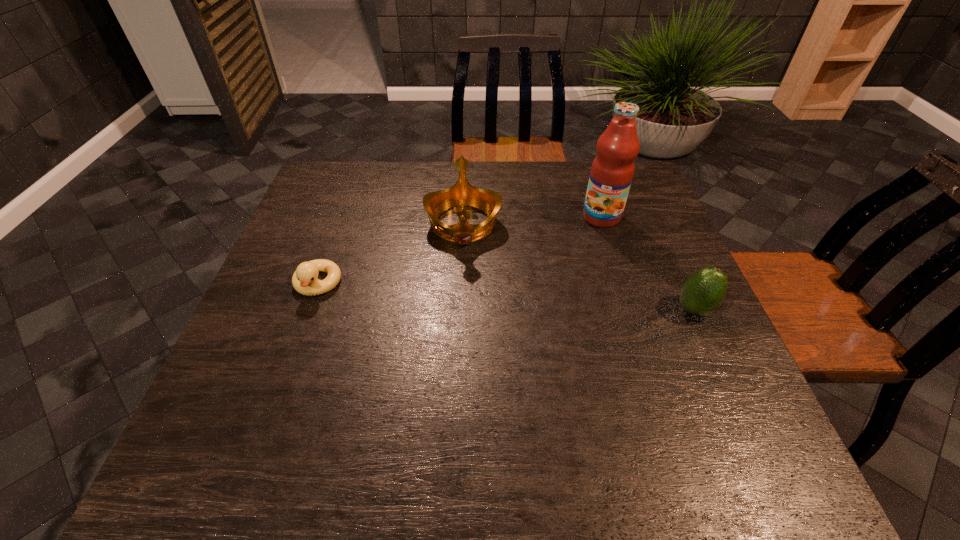
The height and width of the screenshot is (540, 960). Identify the location of free space on the desktop that is between the shortest object and the rightmost object and is positioned on the front label of the third object from left to right. (551, 300).

Locate an element on the screen. This screenshot has height=540, width=960. vacant space on the desktop that is between the duckling and the rightmost object and is positioned at the front emblem of the third object from right to left is located at coordinates (465, 294).